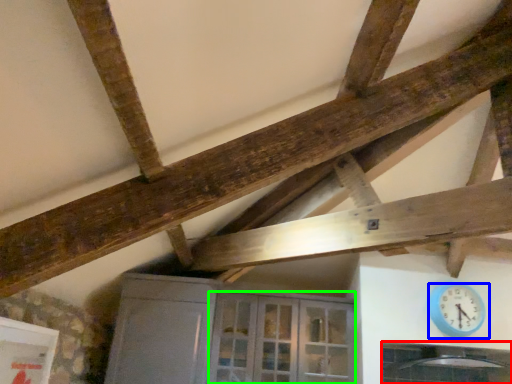
Question: Which object is positioned closest to window (highlighted by a red box)? Select from wall clock (highlighted by a blue box) and glass door (highlighted by a green box).

Choices:
 (A) wall clock
 (B) glass door

Answer: (A)